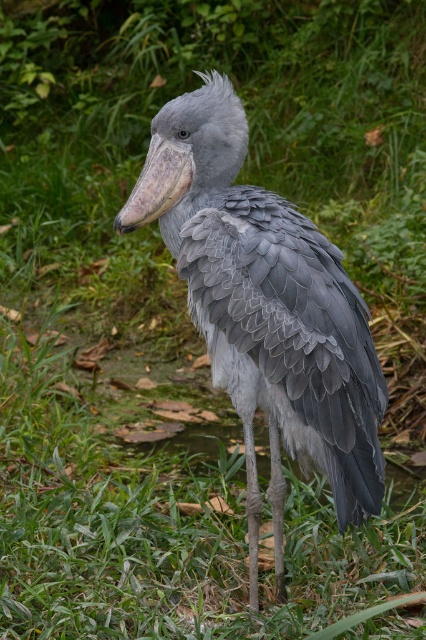
Question: Does gray feathered bird at center have a larger size compared to gray matte beak at center?

Choices:
 (A) no
 (B) yes

Answer: (B)

Question: Among these points, which one is farthest from the camera?

Choices:
 (A) (152, 211)
 (B) (265, 257)

Answer: (A)

Question: Does gray feathered bird at center have a smaller size compared to gray matte beak at center?

Choices:
 (A) yes
 (B) no

Answer: (B)

Question: Does gray feathered bird at center lie behind gray matte beak at center?

Choices:
 (A) yes
 (B) no

Answer: (B)

Question: Among these objects, which one is farthest from the camera?

Choices:
 (A) gray feathered bird at center
 (B) gray matte beak at center

Answer: (B)